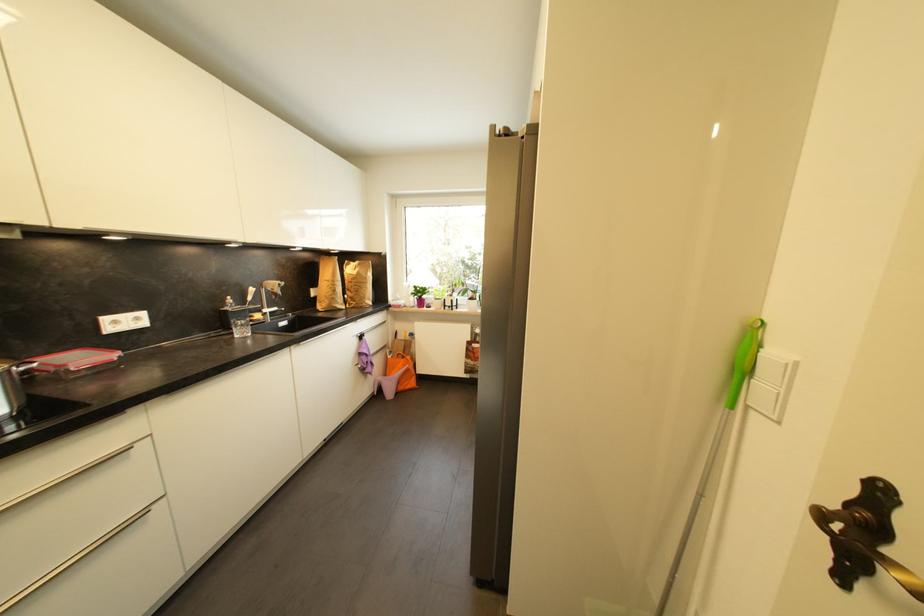
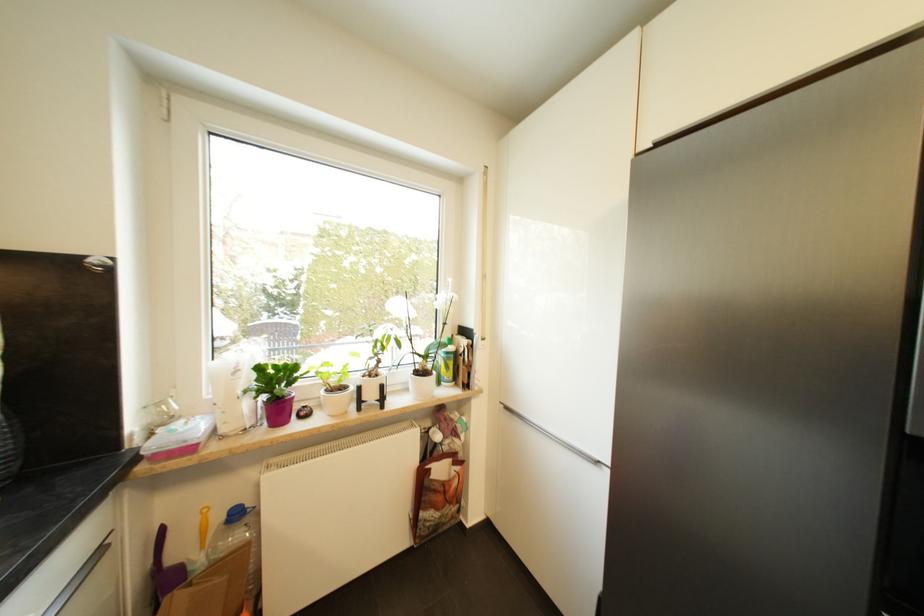
Find the pixel in the second image that matches pixel 426 305 in the first image.

(285, 411)